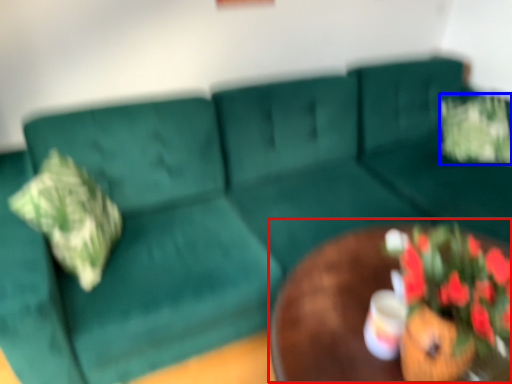
Question: Which point is further to the camera, round table (highlighted by a red box) or flower (highlighted by a blue box)?

Choices:
 (A) round table
 (B) flower

Answer: (B)